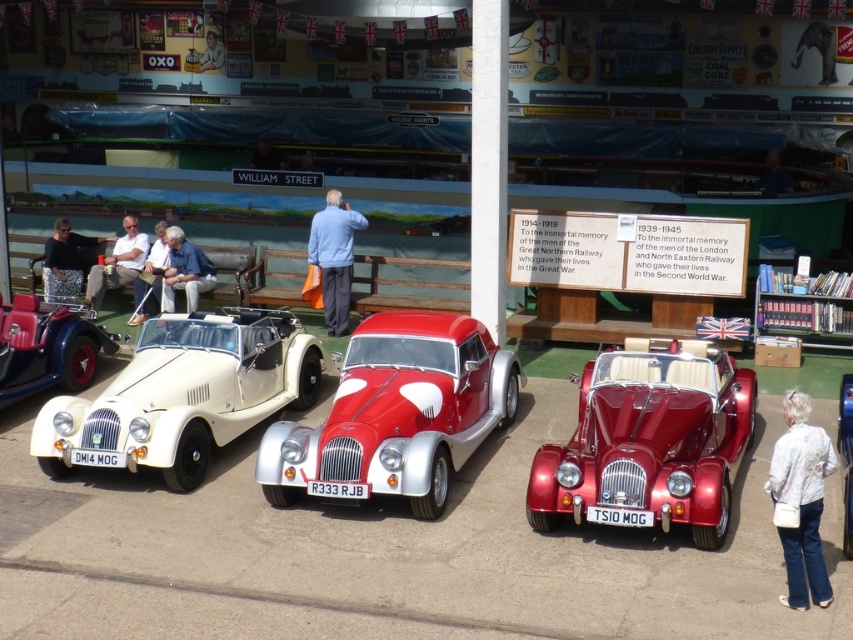
Based on the scene description, what are the coordinates of the white matte convertible at left?

The white matte convertible at left is located at coordinates point (183, 394).

You are standing in front of the vintage car exhibition. You see a white matte convertible at left and a matte black car at left. Which one is closer to you?

The white matte convertible at left is closer to the viewer than the matte black car at left.

You are at the vintage car exhibition and notice two people wearing a blue cotton shirt at center and a white leather jacket at center. Which person is standing closer to the middle of the scene?

The blue cotton shirt at center is to the right of the white leather jacket at center, so the white leather jacket at center is closer to the middle of the scene.